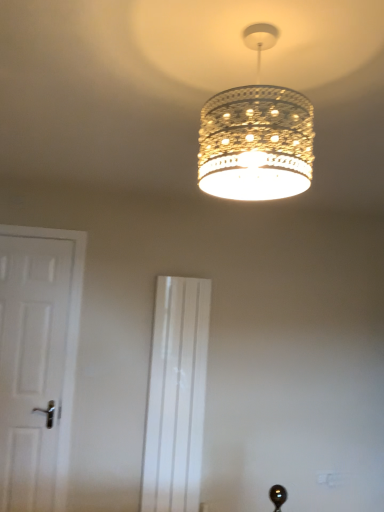
Question: From a real-world perspective, is white glossy screen door at center located higher than clear glass chandelier at upper center?

Choices:
 (A) yes
 (B) no

Answer: (B)

Question: Considering the relative sizes of white glossy screen door at center and clear glass chandelier at upper center in the image provided, is white glossy screen door at center wider than clear glass chandelier at upper center?

Choices:
 (A) no
 (B) yes

Answer: (A)

Question: Is white glossy screen door at center further to the viewer compared to clear glass chandelier at upper center?

Choices:
 (A) yes
 (B) no

Answer: (A)

Question: Is white glossy screen door at center smaller than clear glass chandelier at upper center?

Choices:
 (A) yes
 (B) no

Answer: (B)

Question: Is white glossy screen door at center facing towards clear glass chandelier at upper center?

Choices:
 (A) yes
 (B) no

Answer: (A)

Question: Is white matte door at left wider or thinner than clear glass chandelier at upper center?

Choices:
 (A) thin
 (B) wide

Answer: (A)

Question: From the image's perspective, is white matte door at left positioned above or below clear glass chandelier at upper center?

Choices:
 (A) above
 (B) below

Answer: (B)

Question: Considering the positions of white matte door at left and clear glass chandelier at upper center in the image, is white matte door at left taller or shorter than clear glass chandelier at upper center?

Choices:
 (A) short
 (B) tall

Answer: (B)

Question: Relative to clear glass chandelier at upper center, is white matte door at left in front or behind?

Choices:
 (A) front
 (B) behind

Answer: (B)

Question: Is white glossy screen door at center to the left or to the right of clear glass chandelier at upper center in the image?

Choices:
 (A) right
 (B) left

Answer: (B)

Question: From their relative heights in the image, would you say white glossy screen door at center is taller or shorter than clear glass chandelier at upper center?

Choices:
 (A) short
 (B) tall

Answer: (B)

Question: From the image's perspective, relative to clear glass chandelier at upper center, is white glossy screen door at center above or below?

Choices:
 (A) below
 (B) above

Answer: (A)

Question: In terms of width, does white glossy screen door at center look wider or thinner when compared to clear glass chandelier at upper center?

Choices:
 (A) thin
 (B) wide

Answer: (A)

Question: In terms of height, does clear glass chandelier at upper center look taller or shorter compared to white glossy screen door at center?

Choices:
 (A) tall
 (B) short

Answer: (B)

Question: Would you say clear glass chandelier at upper center is to the left or to the right of white glossy screen door at center in the picture?

Choices:
 (A) right
 (B) left

Answer: (A)